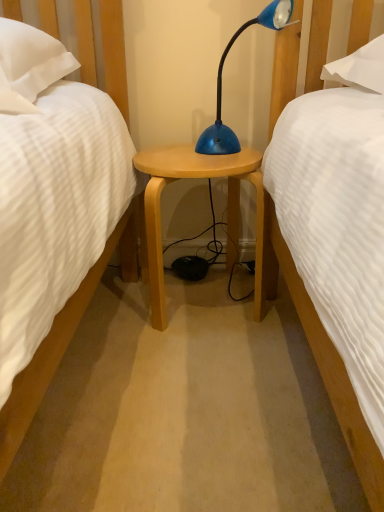
Question: Visually, is blue plastic lamp at center positioned to the left or to the right of light wood/finishednightstand at center?

Choices:
 (A) left
 (B) right

Answer: (B)

Question: Looking at the image, does blue plastic lamp at center seem bigger or smaller compared to light wood/finishednightstand at center?

Choices:
 (A) small
 (B) big

Answer: (A)

Question: Is point (208, 150) positioned closer to the camera than point (162, 166)?

Choices:
 (A) farther
 (B) closer

Answer: (A)

Question: Is point (150, 169) positioned closer to the camera than point (216, 113)?

Choices:
 (A) closer
 (B) farther

Answer: (A)

Question: Visually, is light wood/finishednightstand at center positioned to the left or to the right of blue plastic lamp at center?

Choices:
 (A) right
 (B) left

Answer: (B)

Question: Considering the positions of light wood/finishednightstand at center and blue plastic lamp at center in the image, is light wood/finishednightstand at center taller or shorter than blue plastic lamp at center?

Choices:
 (A) short
 (B) tall

Answer: (B)

Question: In the image, is light wood/finishednightstand at center positioned in front of or behind blue plastic lamp at center?

Choices:
 (A) front
 (B) behind

Answer: (B)